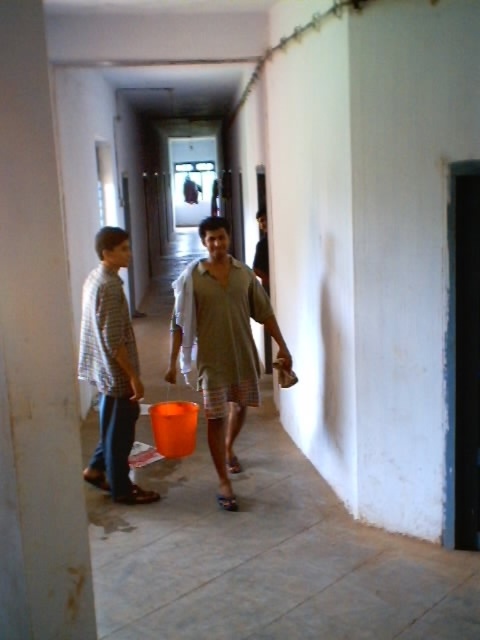
Is point (210, 240) farther from viewer compared to point (121, 452)?

No.

Does matte khaki shirt at center lie behind checkered fabric shirt at left?

Yes, matte khaki shirt at center is further from the viewer.

Is point (213, 259) in front of point (104, 445)?

Yes, it is.

You are a GUI agent. You are given a task and a screenshot of the screen. Output one action in this format:
    pyautogui.click(x=<x>, y=<y>)
    Task: Click on the matte khaki shirt at center
    This screenshot has height=640, width=480.
    Given the screenshot: What is the action you would take?
    (222, 342)

Who is more forward, (83, 596) or (216, 388)?

Point (83, 596)

Can you confirm if white painted pillar at left is taller than matte khaki shirt at center?

Yes, white painted pillar at left is taller than matte khaki shirt at center.

Find the location of a particular element. The image size is (480, 640). white painted pillar at left is located at coordinates (36, 358).

This screenshot has width=480, height=640. I want to click on white painted pillar at left, so [x=36, y=358].

Does white painted pillar at left come in front of checkered fabric shirt at left?

Yes, it is.

Is point (31, 531) farther from viewer compared to point (121, 237)?

No.

At what (x,y) coordinates should I click in order to perform the action: click on white painted pillar at left. Please return your answer as a coordinate pair (x, y). The width and height of the screenshot is (480, 640). Looking at the image, I should click on (36, 358).